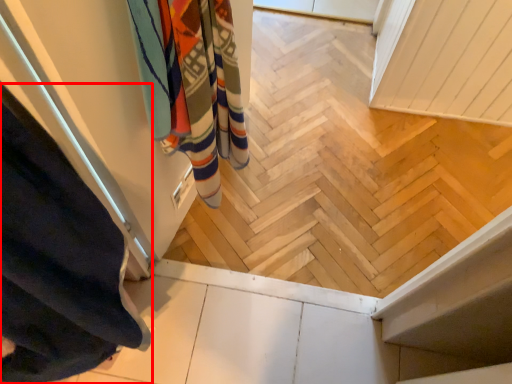
Question: Considering the relative positions of curtain (annotated by the red box) and bath towel in the image provided, where is curtain (annotated by the red box) located with respect to the staircase?

Choices:
 (A) right
 (B) left

Answer: (B)